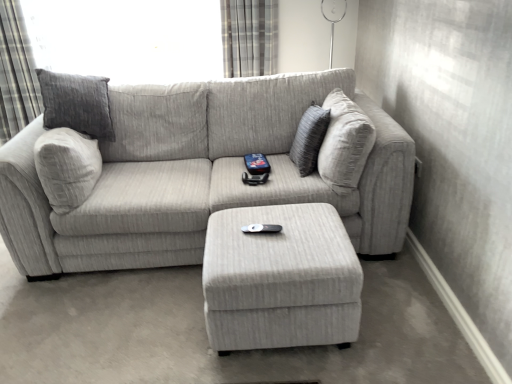
Locate an element on the screen. The image size is (512, 384). free spot in front of black plastic remote at center is located at coordinates (266, 252).